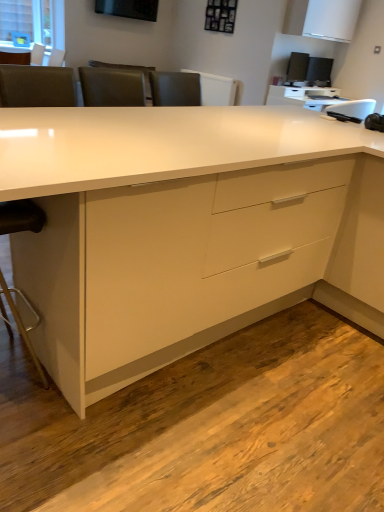
Question: Is point tap(337, 27) closer or farther from the camera than point tap(324, 64)?

Choices:
 (A) farther
 (B) closer

Answer: (B)

Question: Considering the positions of white glossy cabinet at upper right and black plastic desktop computer at upper right in the image, is white glossy cabinet at upper right bigger or smaller than black plastic desktop computer at upper right?

Choices:
 (A) big
 (B) small

Answer: (A)

Question: Which is farther from the black plastic desktop computer at upper right?

Choices:
 (A) white glossy computer desk at upper right
 (B) white glossy desk at center
 (C) white glossy cabinet at upper right
 (D) black leather swivel chair at left

Answer: (D)

Question: Based on their relative distances, which object is nearer to the black plastic desktop computer at upper right?

Choices:
 (A) black leather swivel chair at left
 (B) white glossy computer desk at upper right
 (C) white glossy desk at center
 (D) white glossy cabinet at upper right

Answer: (B)